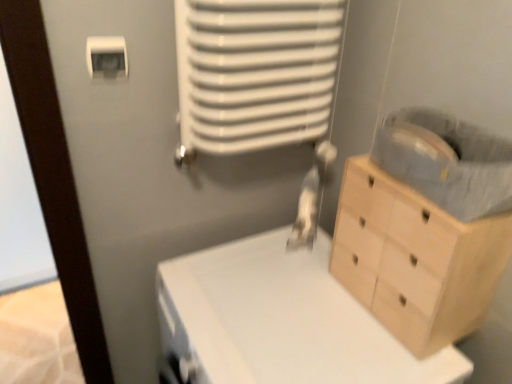
Question: Considering the relative positions of light wood chest of drawers at right and white plastic light switch at upper left in the image provided, is light wood chest of drawers at right to the right of white plastic light switch at upper left from the viewer's perspective?

Choices:
 (A) no
 (B) yes

Answer: (B)

Question: Is white plastic light switch at upper left surrounded by light wood chest of drawers at right?

Choices:
 (A) no
 (B) yes

Answer: (A)

Question: Is the depth of light wood chest of drawers at right greater than that of white plastic light switch at upper left?

Choices:
 (A) no
 (B) yes

Answer: (A)

Question: From the image's perspective, does light wood chest of drawers at right appear higher than white plastic light switch at upper left?

Choices:
 (A) no
 (B) yes

Answer: (A)

Question: Is light wood chest of drawers at right wider than white plastic light switch at upper left?

Choices:
 (A) no
 (B) yes

Answer: (B)

Question: Considering the positions of white matte changing table at center and white plastic light switch at upper left in the image, is white matte changing table at center taller or shorter than white plastic light switch at upper left?

Choices:
 (A) short
 (B) tall

Answer: (B)

Question: Is white matte changing table at center in front of or behind white plastic light switch at upper left in the image?

Choices:
 (A) behind
 (B) front

Answer: (B)

Question: Would you say white matte changing table at center is to the left or to the right of white plastic light switch at upper left in the picture?

Choices:
 (A) right
 (B) left

Answer: (A)

Question: Is point (165, 311) closer or farther from the camera than point (104, 49)?

Choices:
 (A) farther
 (B) closer

Answer: (A)

Question: From a real-world perspective, relative to white plastic light switch at upper left, is light wood chest of drawers at right vertically above or below?

Choices:
 (A) above
 (B) below

Answer: (B)

Question: Would you say light wood chest of drawers at right is to the left or to the right of white plastic light switch at upper left in the picture?

Choices:
 (A) right
 (B) left

Answer: (A)

Question: Would you say light wood chest of drawers at right is inside or outside white plastic light switch at upper left?

Choices:
 (A) inside
 (B) outside

Answer: (B)

Question: From their relative heights in the image, would you say light wood chest of drawers at right is taller or shorter than white plastic light switch at upper left?

Choices:
 (A) short
 (B) tall

Answer: (B)

Question: Considering the positions of point pos(393,347) and point pos(410,337), is point pos(393,347) closer or farther from the camera than point pos(410,337)?

Choices:
 (A) farther
 (B) closer

Answer: (A)

Question: In the image, is white matte changing table at center on the left side or the right side of light wood chest of drawers at right?

Choices:
 (A) left
 (B) right

Answer: (A)